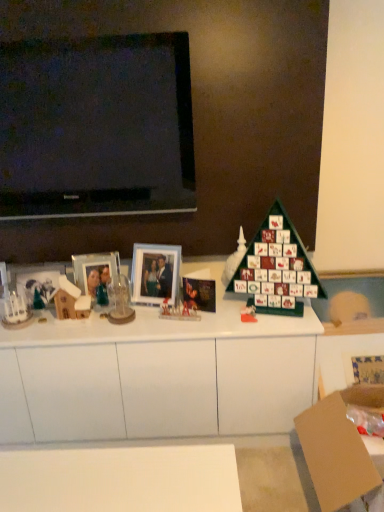
Question: Considering the positions of green matte advent calendar at center, marked as the fourth toy in a left-to-right arrangement, and translucent glass figurine at center, which appears as the third toy when viewed from the right, in the image, is green matte advent calendar at center, marked as the fourth toy in a left-to-right arrangement, taller or shorter than translucent glass figurine at center, which appears as the third toy when viewed from the right,?

Choices:
 (A) tall
 (B) short

Answer: (B)

Question: Considering the positions of point click(x=243, y=309) and point click(x=162, y=314), is point click(x=243, y=309) closer or farther from the camera than point click(x=162, y=314)?

Choices:
 (A) closer
 (B) farther

Answer: (B)

Question: Estimate the real-world distances between objects in this image. Which object is closer to the matte plastic picture frame at center, the first picture frame positioned from the right?

Choices:
 (A) green matte advent calendar at center, which is the first toy from right to left
 (B) wooden house at left, which ranks as the fourth toy in right-to-left order
 (C) brown cardboard box at lower right
 (D) glossy paper christmas card at center
 (E) translucent glass figurine at center, which appears as the third toy when viewed from the right

Answer: (E)

Question: Which of these objects is positioned closest to the matte plastic picture frame at center, the first picture frame positioned from the right?

Choices:
 (A) green matte advent calendar at right
 (B) white matte cabinet at center
 (C) white matte christmas tree at center, acting as the third toy starting from the left
 (D) green matte advent calendar at center, marked as the fourth toy in a left-to-right arrangement
 (E) wooden house at left, which ranks as the fourth toy in right-to-left order

Answer: (E)